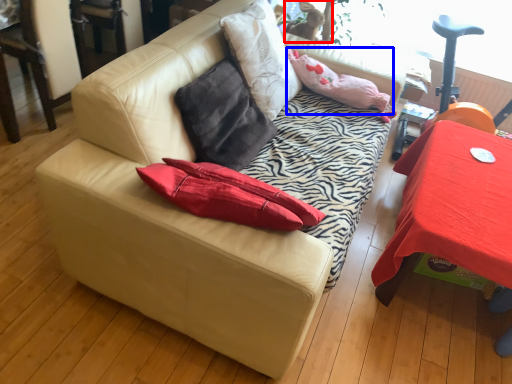
Question: Which of the following is the closest to the observer, animal (highlighted by a red box) or pillow (highlighted by a blue box)?

Choices:
 (A) animal
 (B) pillow

Answer: (B)